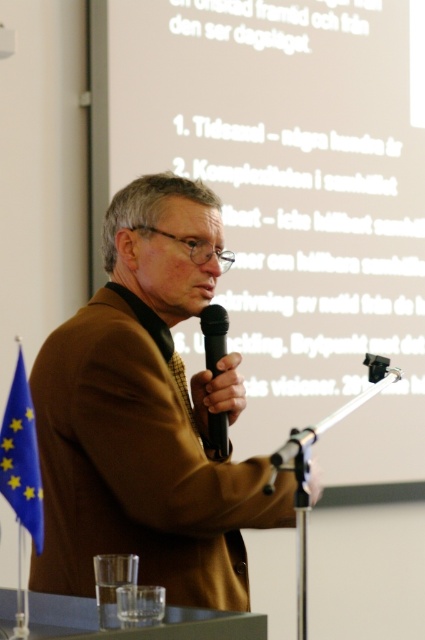
Question: In this image, where is brown leather jacket at center located relative to black matte microphone at center?

Choices:
 (A) above
 (B) below

Answer: (B)

Question: Which point is farther to the camera?

Choices:
 (A) (356, 145)
 (B) (203, 579)
 (C) (206, 310)

Answer: (A)

Question: Is white matte projection screen at upper center further to the viewer compared to black matte microphone at center?

Choices:
 (A) yes
 (B) no

Answer: (A)

Question: Among these points, which one is nearest to the camera?

Choices:
 (A) (204, 321)
 (B) (201, 212)

Answer: (A)

Question: Which of the following is the closest to the observer?

Choices:
 (A) brown leather jacket at center
 (B) white matte projection screen at upper center
 (C) black matte microphone at center

Answer: (A)

Question: Can you confirm if white matte projection screen at upper center is positioned above black matte microphone at center?

Choices:
 (A) no
 (B) yes

Answer: (B)